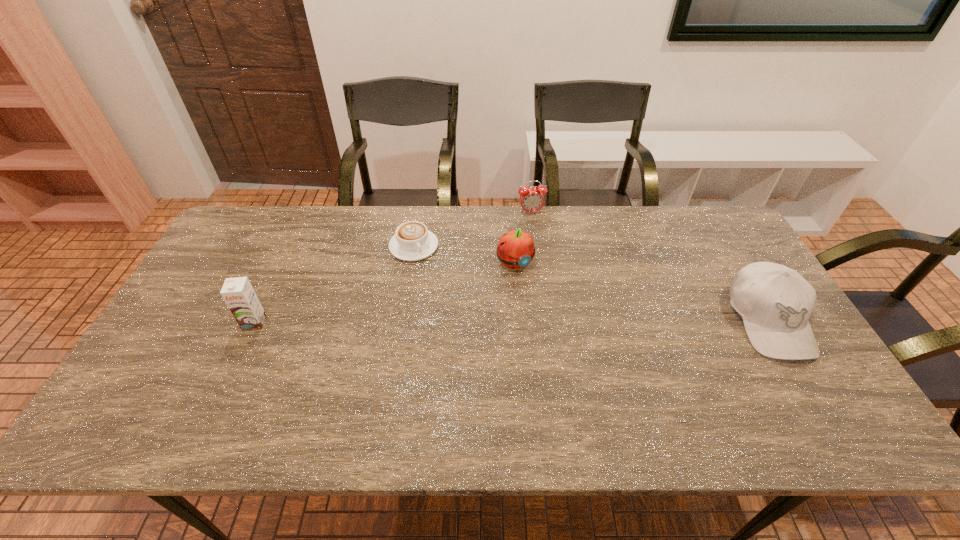
You are a GUI agent. You are given a task and a screenshot of the screen. Output one action in this format:
    pyautogui.click(x=<x>, y=<y>)
    Task: Click on the vacant area that lies between the apple and the baseball cap
    
    Given the screenshot: What is the action you would take?
    pyautogui.click(x=641, y=292)

Where is `empty space between the apple and the shortest object`? The width and height of the screenshot is (960, 540). empty space between the apple and the shortest object is located at coordinates (465, 255).

The image size is (960, 540). I want to click on vacant area between the chocolate milk and the shortest object, so click(x=334, y=284).

Find the location of a particular element. vacant area that lies between the rightmost object and the apple is located at coordinates (641, 292).

Identify the location of free space between the chocolate milk and the apple. This screenshot has width=960, height=540. (385, 293).

Locate which object is the third closest to the cappuccino. Please provide its 2D coordinates. Your answer should be formatted as a tuple, i.e. [(x, y)], where the tuple contains the x and y coordinates of a point satisfying the conditions above.

[(238, 293)]

Identify which object is located as the third nearest to the baseball cap. Please provide its 2D coordinates. Your answer should be formatted as a tuple, i.e. [(x, y)], where the tuple contains the x and y coordinates of a point satisfying the conditions above.

[(412, 241)]

I want to click on free spot that satisfies the following two spatial constraints: 1. on the back side of the alarm clock; 2. on the left side of the leftmost object, so click(x=305, y=213).

Locate an element on the screen. The image size is (960, 540). free space that satisfies the following two spatial constraints: 1. on the back side of the apple; 2. on the left side of the alarm clock is located at coordinates (511, 213).